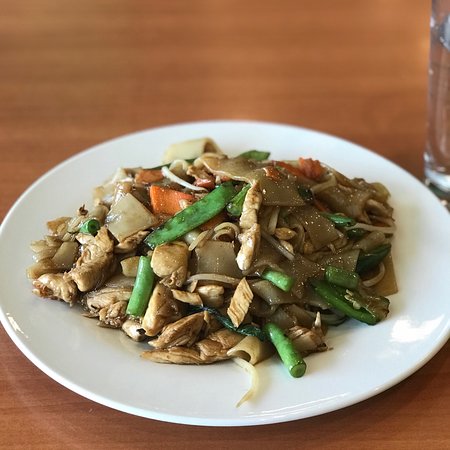
Locate an element on the screen. This screenshot has width=450, height=450. edge of plate is located at coordinates (114, 406).